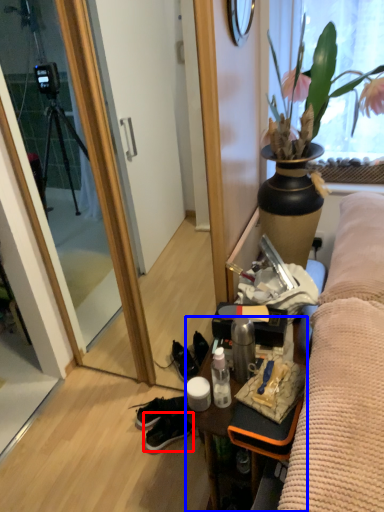
Question: Which of the following is the closest to the observer, sneakers (highlighted by a red box) or desk (highlighted by a blue box)?

Choices:
 (A) sneakers
 (B) desk

Answer: (B)